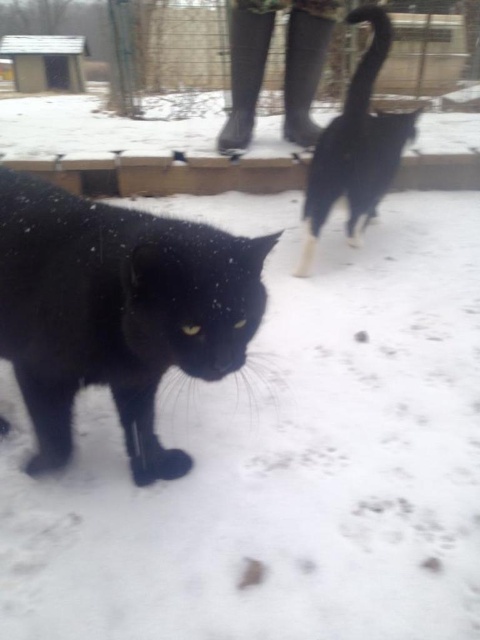
Between black matte fur cat at center and black fur cat at upper right, which one has more height?

black fur cat at upper right

Find the location of a particular element. This screenshot has height=640, width=480. black matte fur cat at center is located at coordinates (117, 310).